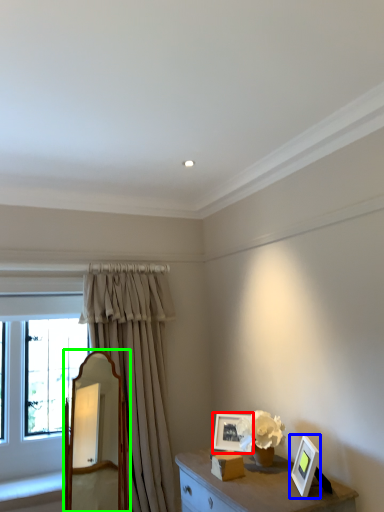
Question: Estimate the real-world distances between objects in this image. Which object is closer to picture frame (highlighted by a red box), picture frame (highlighted by a blue box) or mirror (highlighted by a green box)?

Choices:
 (A) picture frame
 (B) mirror

Answer: (A)